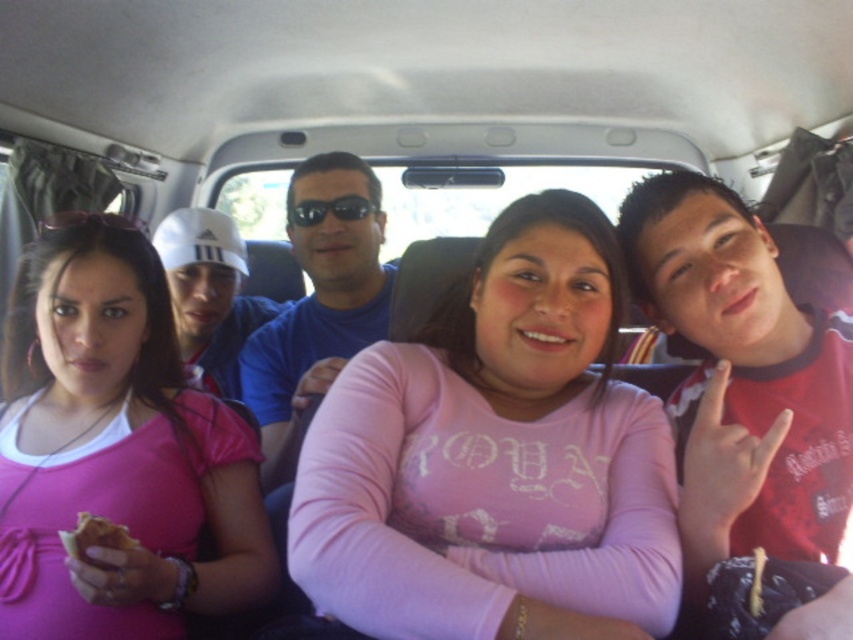
You are a photographer standing 30 inches away from the pink matte shirt at center. You want to take a photo of the matte black sunglasses at upper left without moving your position. Can you reach the sunglasses with your camera lens?

The pink matte shirt at center is 28.07 inches away from the matte black sunglasses at upper left. Since you are 30 inches away from the pink matte shirt at center, the matte black sunglasses at upper left would be approximately 30 inches minus 28.07 inches equals 1.93 inches away from you. Therefore, you can reach the matte black sunglasses at upper left with your camera lens as they are within your current position range.

You are a passenger in the vehicle and want to hand a snack to the person wearing the pink matte shirt at left. Based on their position, where should you aim to place the snack so it reaches them?

The pink matte shirt at left is located at point (115, 452), so you should aim to place the snack near that coordinate to reach them.